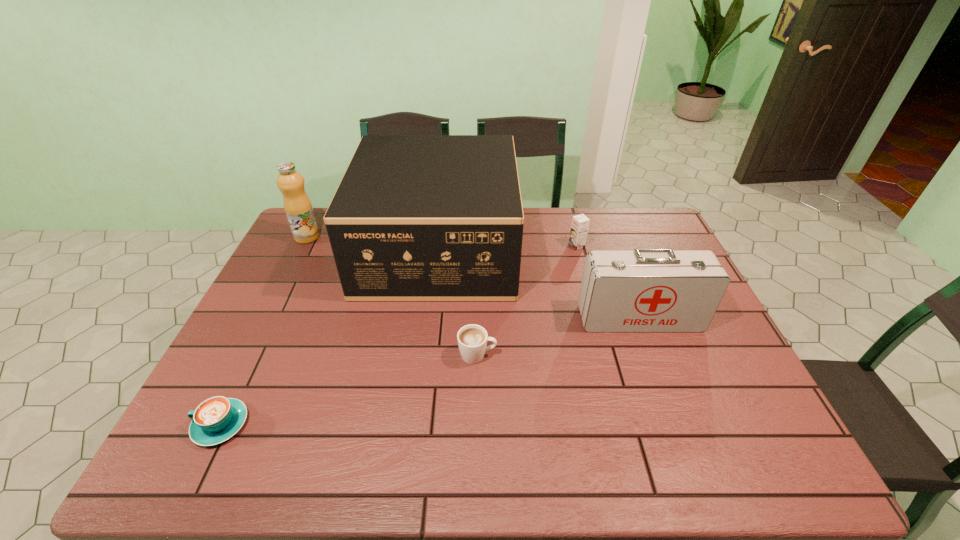
Identify the location of box. (415, 217).

Find the location of a particular element. This screenshot has height=540, width=960. fruit juice is located at coordinates (298, 208).

Where is `the third tallest object`? the third tallest object is located at coordinates (643, 290).

Where is `the first-aid kit`? the first-aid kit is located at coordinates (643, 290).

At what (x,y) coordinates should I click in order to perform the action: click on chocolate milk. Please return your answer as a coordinate pair (x, y). The width and height of the screenshot is (960, 540). Looking at the image, I should click on (580, 223).

I want to click on the right cappuccino, so click(x=472, y=339).

The image size is (960, 540). In order to click on the farther cappuccino in this screenshot , I will do `click(472, 339)`.

The width and height of the screenshot is (960, 540). In order to click on the nearer cappuccino in this screenshot , I will do `click(215, 420)`.

Locate an element on the screen. The height and width of the screenshot is (540, 960). the nearest object is located at coordinates (215, 420).

The image size is (960, 540). What are the coordinates of `vacant space located on the front-facing side of the box` in the screenshot? It's located at (540, 249).